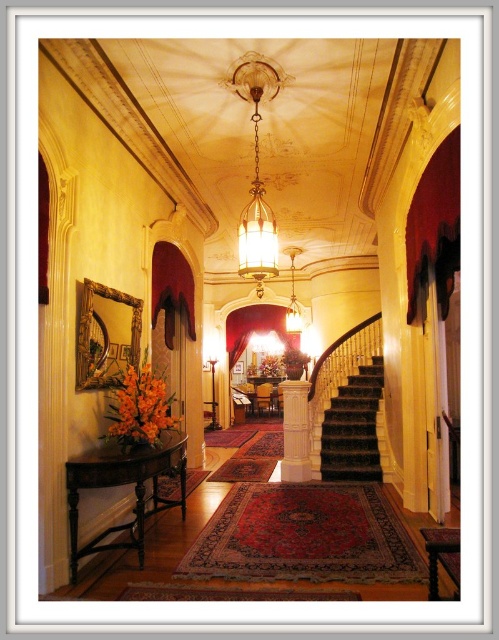
Question: Among these objects, which one is nearest to the camera?

Choices:
 (A) translucent glass chandelier at center
 (B) dark brown carpeted stairs at center
 (C) matte black console table at left

Answer: (C)

Question: Does dark brown carpeted stairs at center appear on the right side of translucent glass chandelier at center?

Choices:
 (A) no
 (B) yes

Answer: (B)

Question: Is matte black console table at left behind translucent glass chandelier at center?

Choices:
 (A) no
 (B) yes

Answer: (A)

Question: Which object is the farthest from the translucent glass chandelier at center?

Choices:
 (A) dark brown carpeted stairs at center
 (B) matte black console table at left

Answer: (A)

Question: Does matte black console table at left appear under translucent glass chandelier at center?

Choices:
 (A) no
 (B) yes

Answer: (B)

Question: Which point is farther to the camera?

Choices:
 (A) (332, 461)
 (B) (177, 204)

Answer: (A)